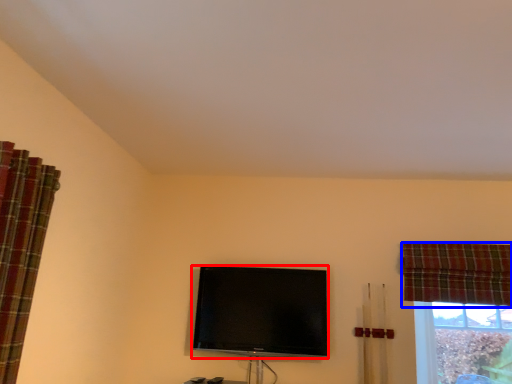
Question: Which point is further to the camera, television (highlighted by a red box) or curtain (highlighted by a blue box)?

Choices:
 (A) television
 (B) curtain

Answer: (A)